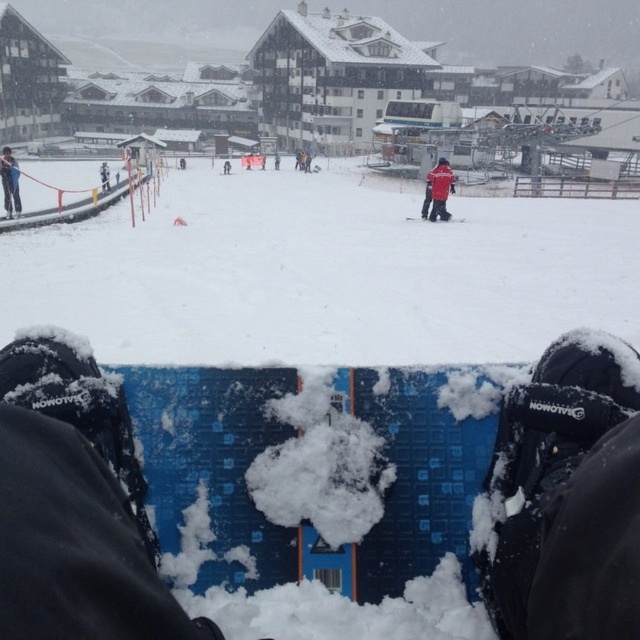
Question: Does white fluffy snow at center appear on the left side of blue textured snowboard at center?

Choices:
 (A) no
 (B) yes

Answer: (B)

Question: Is the position of white fluffy snow at center less distant than that of red matte jacket at center?

Choices:
 (A) no
 (B) yes

Answer: (B)

Question: Which object appears farthest from the camera in this image?

Choices:
 (A) blue textured snowboard at center
 (B) white fluffy snow at center

Answer: (B)

Question: Which object is positioned farthest from the blue textured snowboard at center?

Choices:
 (A) red matte jacket at center
 (B) white fluffy snow at center
 (C) white snowboard at center

Answer: (C)

Question: Observing the image, what is the correct spatial positioning of blue textured snowboard at center in reference to dark blue snowboard at left?

Choices:
 (A) below
 (B) above

Answer: (A)

Question: Which object appears farthest from the camera in this image?

Choices:
 (A) white fluffy snow at center
 (B) white snowboard at center

Answer: (B)